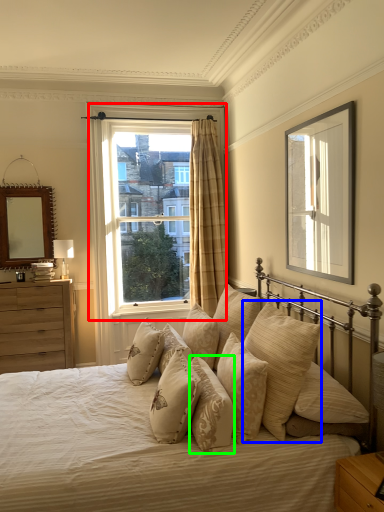
Question: Which is nearer to the window (highlighted by a red box)? pillow (highlighted by a blue box) or pillow (highlighted by a green box).

Choices:
 (A) pillow
 (B) pillow

Answer: (A)